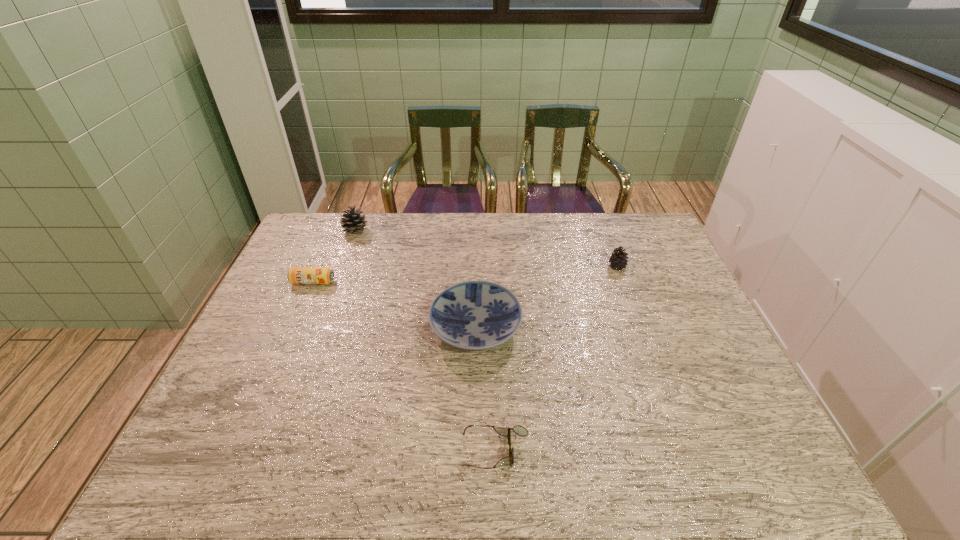
The width and height of the screenshot is (960, 540). Identify the location of free spot between the plate and the taller pinecone. (416, 280).

Image resolution: width=960 pixels, height=540 pixels. Identify the location of vacant area that lies between the farther pinecone and the shortest object. (425, 341).

Identify the location of free spot between the tallest object and the shorter pinecone. (487, 249).

The image size is (960, 540). Find the location of `vacant area that lies between the nearer pinecone and the spectacles`. vacant area that lies between the nearer pinecone and the spectacles is located at coordinates pos(556,359).

Find the location of a particular element. The height and width of the screenshot is (540, 960). vacant space that is in between the spectacles and the plate is located at coordinates (486, 389).

Locate an element on the screen. Image resolution: width=960 pixels, height=540 pixels. free space that is in between the rightmost object and the fourth farthest object is located at coordinates (546, 298).

This screenshot has height=540, width=960. Identify the location of vacant point located between the farthest object and the rightmost object. (487, 249).

Locate an element on the screen. Image resolution: width=960 pixels, height=540 pixels. vacant area between the beer can and the spectacles is located at coordinates (404, 366).

Where is `the third closest object to the third farthest object`? The width and height of the screenshot is (960, 540). the third closest object to the third farthest object is located at coordinates (519, 430).

Where is `the closest object to the taller pinecone`? The height and width of the screenshot is (540, 960). the closest object to the taller pinecone is located at coordinates (296, 275).